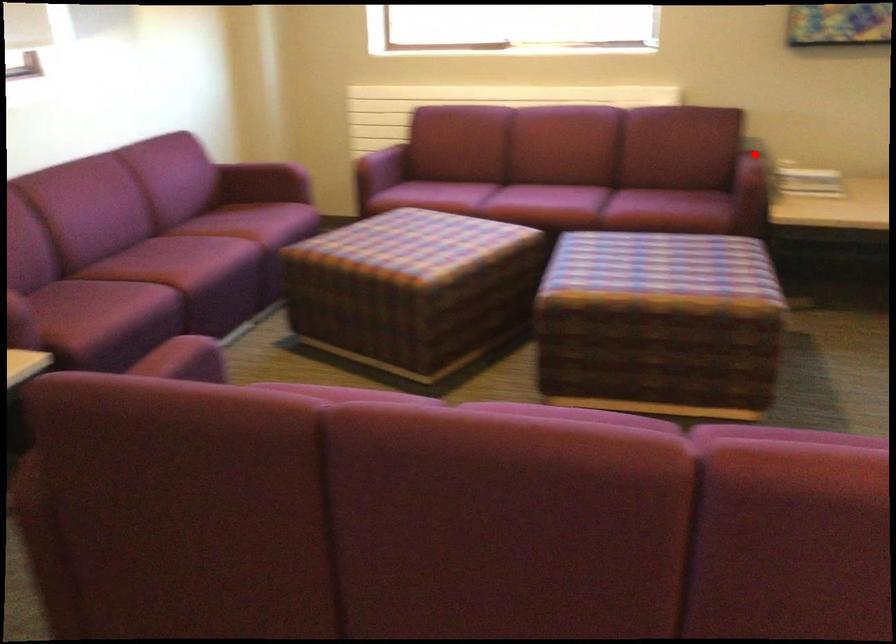
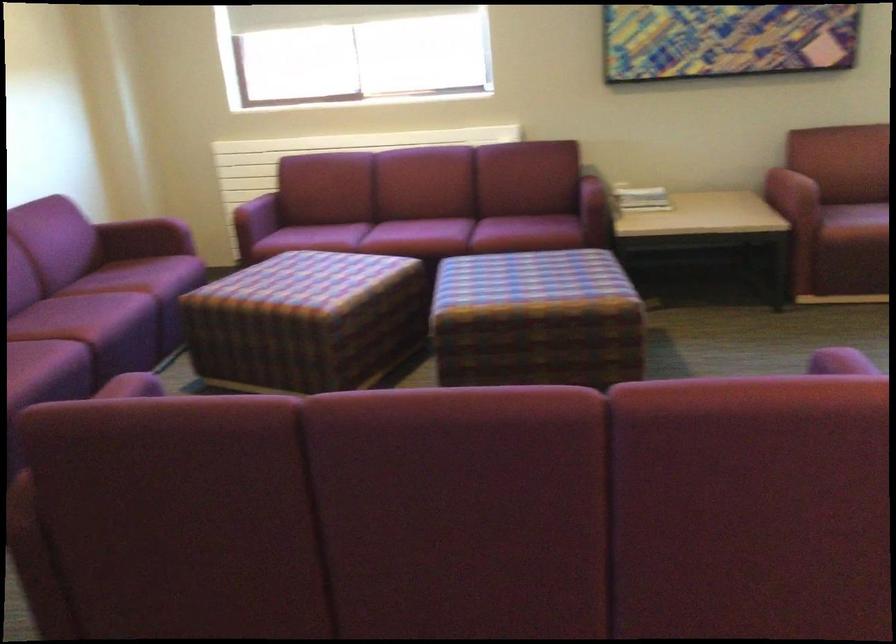
Locate, in the second image, the point that corresponds to the highlighted location in the first image.

(596, 178)